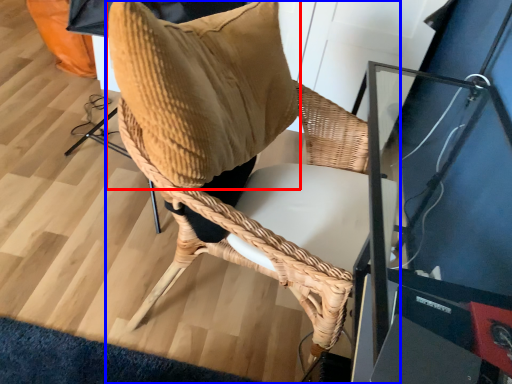
Question: Which object is closer to the camera taking this photo, bean bag chair (highlighted by a red box) or chair (highlighted by a blue box)?

Choices:
 (A) bean bag chair
 (B) chair

Answer: (A)